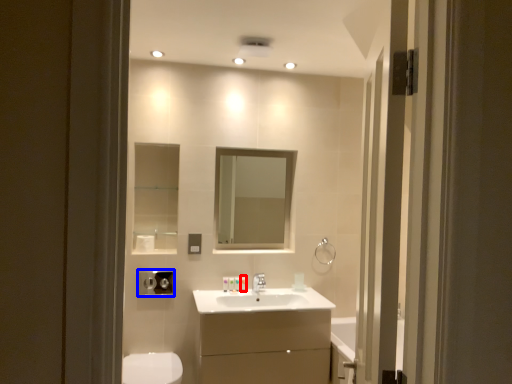
Question: Which point is closer to the camera, toiletry (highlighted by a red box) or hand dryer (highlighted by a blue box)?

Choices:
 (A) toiletry
 (B) hand dryer

Answer: (B)